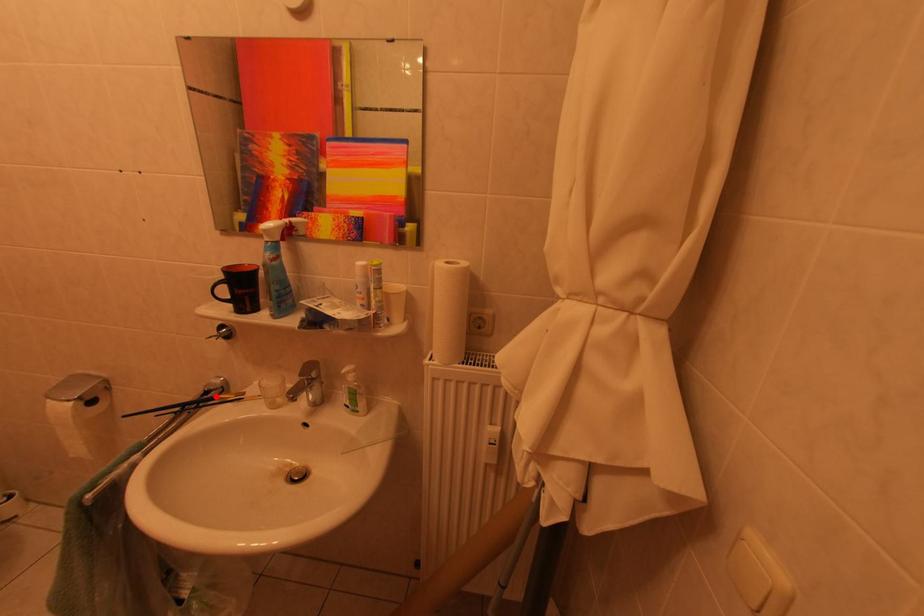
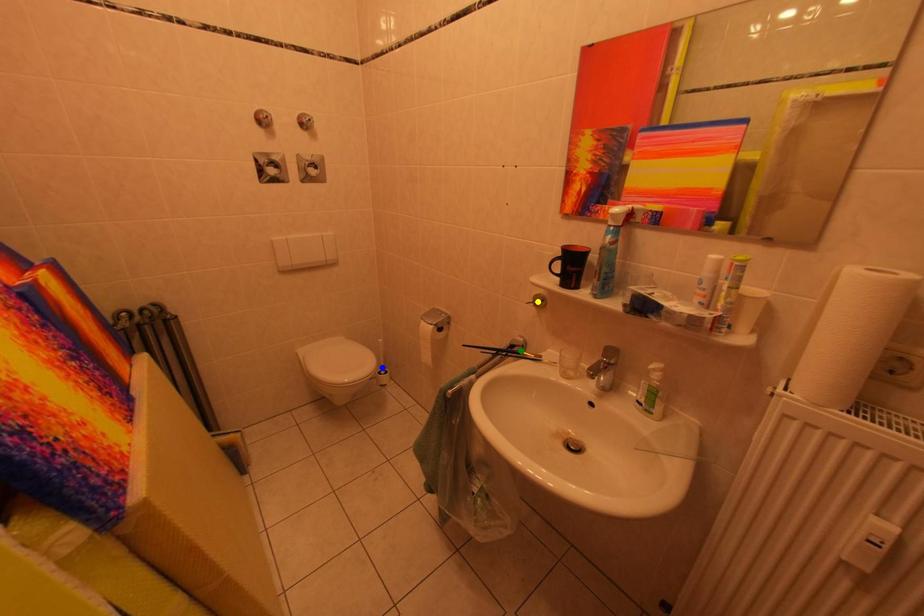
Question: I am providing you with two images of the same scene from different viewpoints. A red point is marked on the first image. You are given multiple points on the second image. Which spot in image 2 lines up with the point in image 1?

Choices:
 (A) green point
 (B) yellow point
 (C) blue point

Answer: (A)